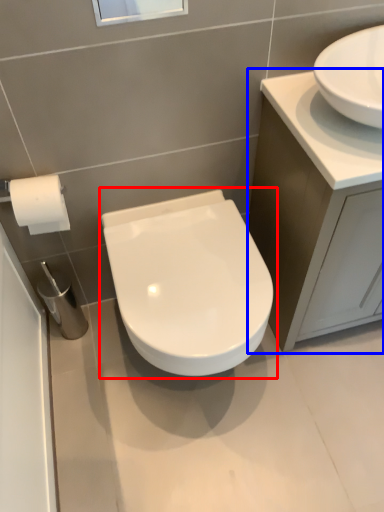
Question: Which object is closer to the camera taking this photo, toilet (highlighted by a red box) or bathroom cabinet (highlighted by a blue box)?

Choices:
 (A) toilet
 (B) bathroom cabinet

Answer: (B)